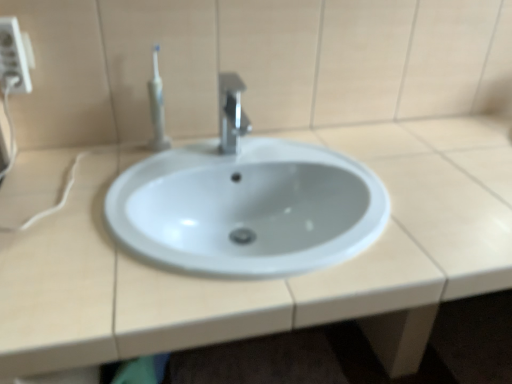
Question: Is polished metallic faucet at center oriented towards white plastic toothbrush at upper left?

Choices:
 (A) no
 (B) yes

Answer: (A)

Question: Does polished metallic faucet at center have a greater width compared to white plastic toothbrush at upper left?

Choices:
 (A) no
 (B) yes

Answer: (B)

Question: From the image's perspective, would you say polished metallic faucet at center is shown under white plastic toothbrush at upper left?

Choices:
 (A) no
 (B) yes

Answer: (B)

Question: Is polished metallic faucet at center in front of white plastic toothbrush at upper left?

Choices:
 (A) no
 (B) yes

Answer: (B)

Question: Can you confirm if polished metallic faucet at center is positioned to the right of white plastic toothbrush at upper left?

Choices:
 (A) no
 (B) yes

Answer: (B)

Question: Can you confirm if polished metallic faucet at center is smaller than white plastic toothbrush at upper left?

Choices:
 (A) yes
 (B) no

Answer: (B)

Question: Is white plastic electric outlet at upper left not within polished metallic faucet at center?

Choices:
 (A) no
 (B) yes

Answer: (B)

Question: Is white plastic electric outlet at upper left positioned behind polished metallic faucet at center?

Choices:
 (A) no
 (B) yes

Answer: (A)

Question: Is white plastic electric outlet at upper left shorter than polished metallic faucet at center?

Choices:
 (A) yes
 (B) no

Answer: (A)

Question: Is the depth of white plastic electric outlet at upper left less than that of polished metallic faucet at center?

Choices:
 (A) yes
 (B) no

Answer: (A)

Question: Is white plastic electric outlet at upper left beside polished metallic faucet at center?

Choices:
 (A) yes
 (B) no

Answer: (B)

Question: Does white plastic electric outlet at upper left have a greater width compared to polished metallic faucet at center?

Choices:
 (A) yes
 (B) no

Answer: (B)

Question: From a real-world perspective, is white plastic electric outlet at upper left located beneath white plastic toothbrush at upper left?

Choices:
 (A) yes
 (B) no

Answer: (B)